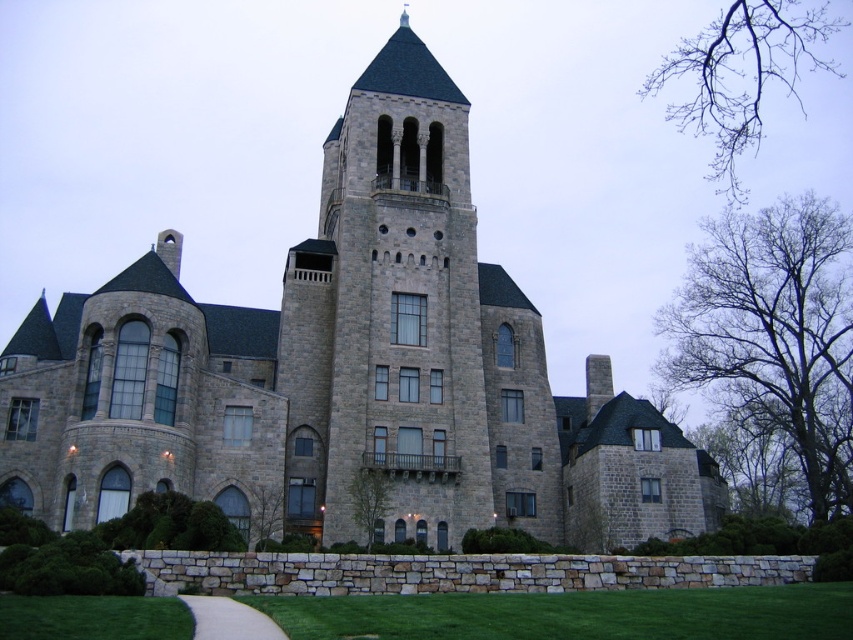
Question: Observing the image, what is the correct spatial positioning of gray stone castle at center in reference to white gravel path at lower center?

Choices:
 (A) below
 (B) above

Answer: (B)

Question: Which is farther from the white gravel path at lower center?

Choices:
 (A) gray stone tower at center
 (B) gray stone castle at center

Answer: (A)

Question: Does gray stone castle at center appear on the right side of white gravel path at lower center?

Choices:
 (A) yes
 (B) no

Answer: (B)

Question: Is gray stone castle at center to the left of white gravel path at lower center from the viewer's perspective?

Choices:
 (A) no
 (B) yes

Answer: (B)

Question: Which of the following is the farthest from the observer?

Choices:
 (A) (218, 600)
 (B) (7, 362)
 (C) (433, 148)

Answer: (C)

Question: Which object appears farthest from the camera in this image?

Choices:
 (A) gray stone castle at center
 (B) white gravel path at lower center
 (C) gray stone tower at center

Answer: (C)